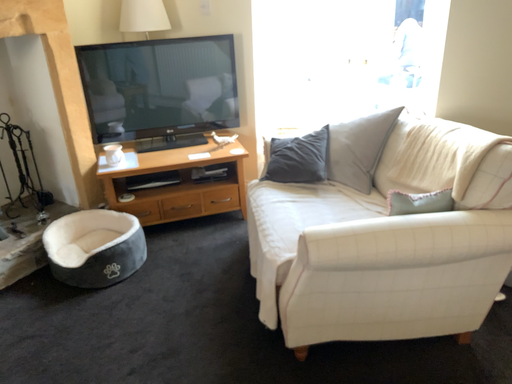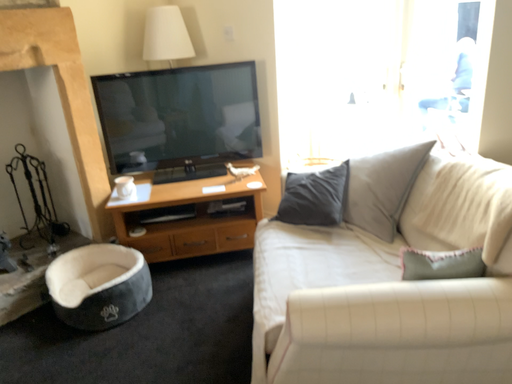
Question: Which way did the camera rotate in the video?

Choices:
 (A) rotated right
 (B) rotated left

Answer: (B)